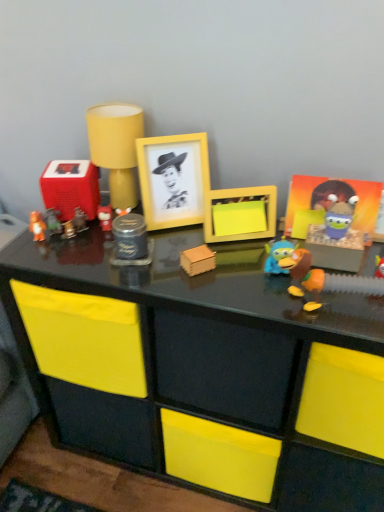
The width and height of the screenshot is (384, 512). Identify the location of vacant area that is in front of yellow matte frame at center, which is counted as the tenth toy, starting from the left. [233, 291].